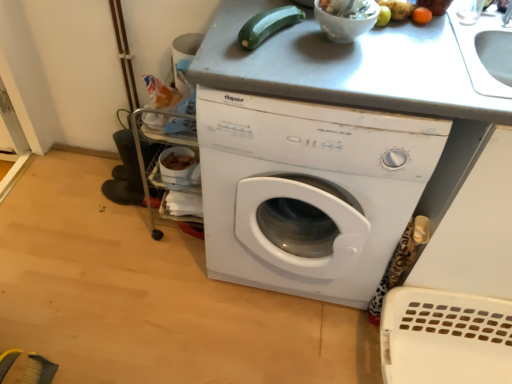
Where is `vacant region in front of white glossy bowl at upper center`? Image resolution: width=512 pixels, height=384 pixels. vacant region in front of white glossy bowl at upper center is located at coordinates (350, 73).